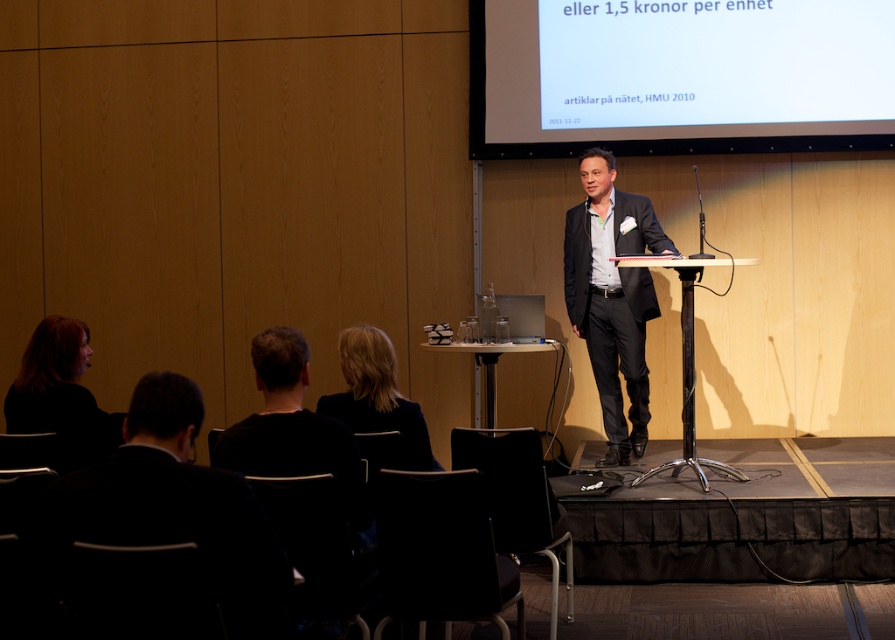
Question: Which of the following is the farthest from the observer?

Choices:
 (A) (496, 458)
 (B) (693, 458)
 (C) (492, 557)

Answer: (B)

Question: Does white matte projection screen at upper center lie in front of black leather chair at lower center?

Choices:
 (A) no
 (B) yes

Answer: (A)

Question: In this image, where is black fabric chair at lower left located relative to blonde hair at center?

Choices:
 (A) left
 (B) right

Answer: (A)

Question: Based on their relative distances, which object is farther from the black metallic podium at center?

Choices:
 (A) black leather chair at lower center
 (B) black suit at lower left

Answer: (B)

Question: Which of the following is the farthest from the observer?

Choices:
 (A) (288, 545)
 (B) (537, 458)
 (C) (148, 449)
 (D) (343, 397)

Answer: (B)

Question: Does black leather chair at lower center have a larger size compared to black plastic chair at lower center?

Choices:
 (A) no
 (B) yes

Answer: (A)